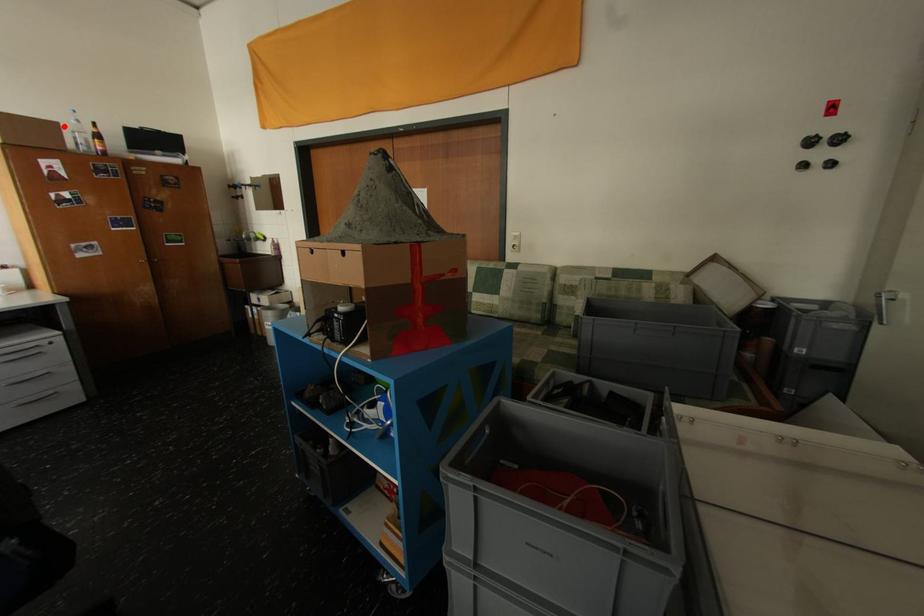
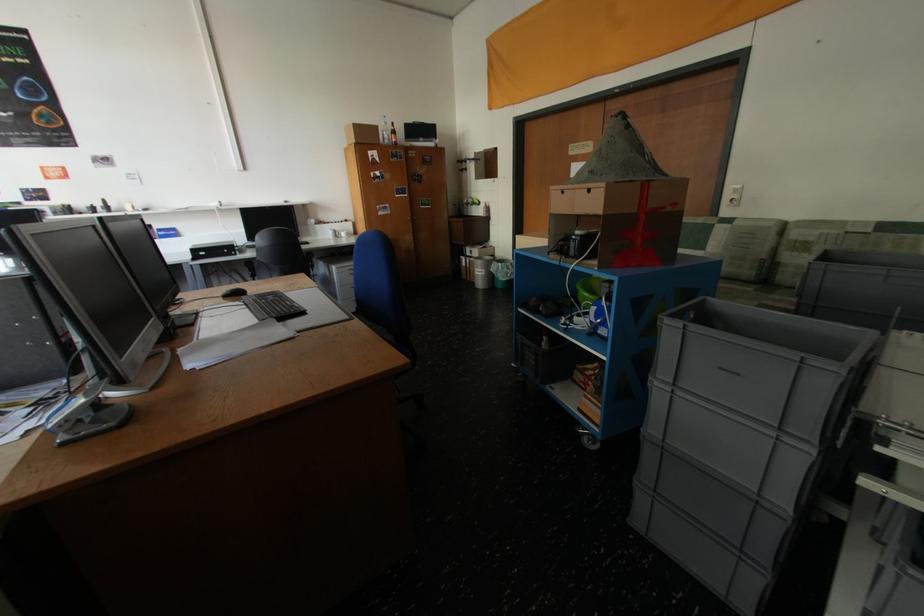
Question: I am providing you with two images of the same scene from different viewpoints. A red point is shown in image1. For the corresponding object point in image2, is it positioned nearer or farther from the camera?

Choices:
 (A) Nearer
 (B) Farther

Answer: (A)